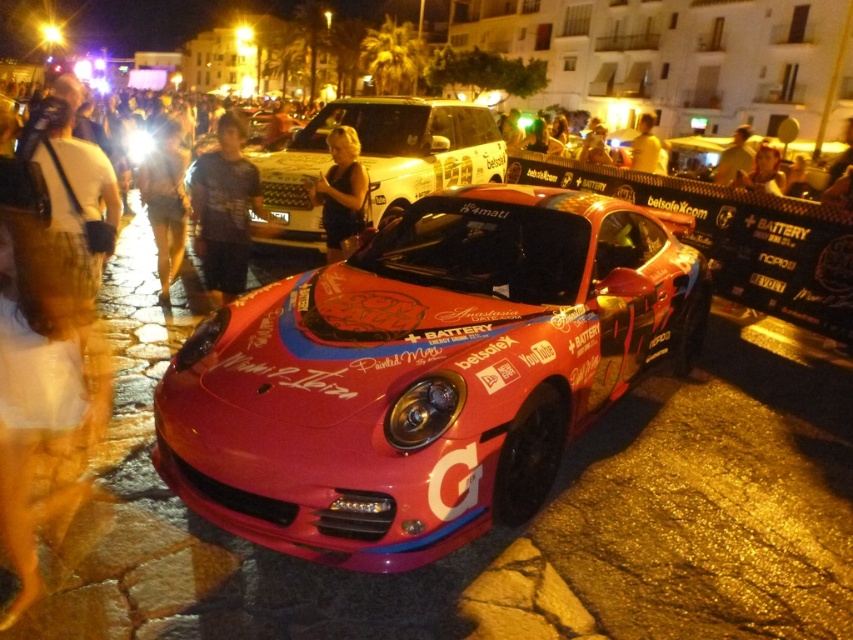
Is point (173, 272) positioned behind point (351, 180)?

Yes, point (173, 272) is farther from viewer.

Who is positioned more to the left, matte black shirt at center or dark brown leather jacket at center?

matte black shirt at center is more to the left.

Does point (177, 241) come farther from viewer compared to point (355, 180)?

Yes, it is.

This screenshot has height=640, width=853. In order to click on matte black shirt at center in this screenshot , I will do `click(165, 198)`.

Between smooth skin face at upper right and yellow t-shirt at upper center, which one has more height?

yellow t-shirt at upper center is taller.

Can you confirm if smooth skin face at upper right is bigger than yellow t-shirt at upper center?

Incorrect, smooth skin face at upper right is not larger than yellow t-shirt at upper center.

Between point (764, 148) and point (643, 172), which one is positioned in front?

Point (764, 148)

Find the location of a particular element. Image resolution: width=853 pixels, height=640 pixels. smooth skin face at upper right is located at coordinates (762, 172).

Does shiny metallic sports car at center appear over black plastic license plate at center?

No, shiny metallic sports car at center is not above black plastic license plate at center.

Can you confirm if shiny metallic sports car at center is wider than black plastic license plate at center?

Yes, shiny metallic sports car at center is wider than black plastic license plate at center.

Between point (529, 280) and point (288, 214), which one is positioned behind?

Positioned behind is point (288, 214).

Identify the location of shiny metallic sports car at center. (425, 372).